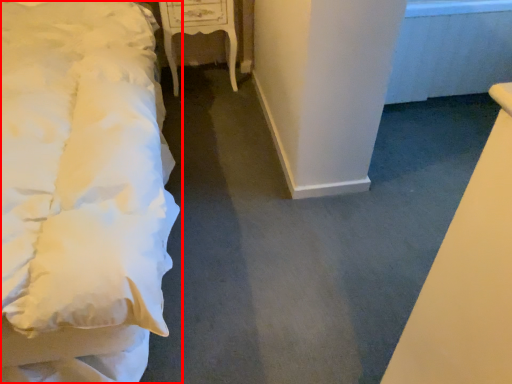
Question: From the image's perspective, what is the correct spatial positioning of bed (annotated by the red box) in reference to furniture?

Choices:
 (A) above
 (B) below

Answer: (B)